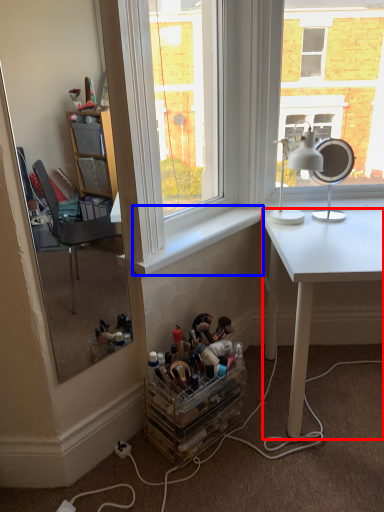
Question: Which of the following is the closest to the observer, desk (highlighted by a red box) or window sill (highlighted by a blue box)?

Choices:
 (A) desk
 (B) window sill

Answer: (A)